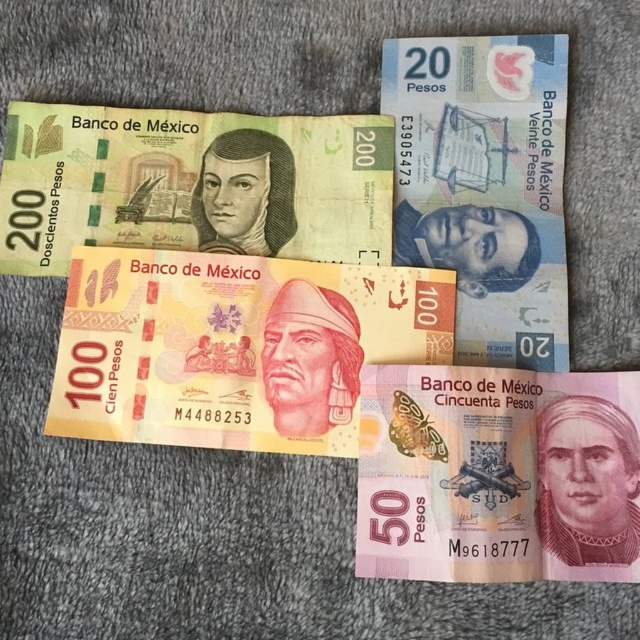
Question: Is yellow paper currency at center wider than pink paper money at center?

Choices:
 (A) no
 (B) yes

Answer: (B)

Question: Which point is farther from the camera taking this photo?

Choices:
 (A) (589, 476)
 (B) (124, 314)
 (C) (234, 198)

Answer: (C)

Question: Which point is closer to the camera?

Choices:
 (A) (220, 333)
 (B) (534, 102)
 (C) (198, 250)

Answer: (A)

Question: Does pink paper money at center have a lesser width compared to green paper currency at upper left?

Choices:
 (A) yes
 (B) no

Answer: (A)

Question: Which point is farther to the camera?

Choices:
 (A) (500, 568)
 (B) (563, 291)
 (C) (209, 184)
 (D) (307, 417)

Answer: (C)

Question: Does yellow paper currency at center have a greater width compared to green paper currency at upper left?

Choices:
 (A) yes
 (B) no

Answer: (B)